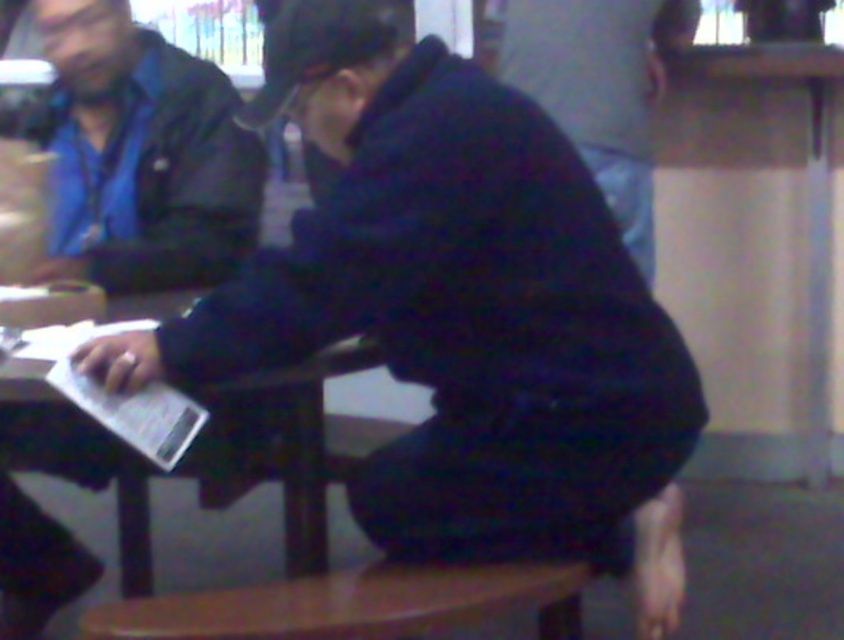
Question: Which of the following is the farthest from the observer?

Choices:
 (A) matte black jacket at upper left
 (B) dark blue fabric at center
 (C) wooden table at center

Answer: (B)

Question: Does wooden stool at lower center have a larger size compared to wooden table at center?

Choices:
 (A) no
 (B) yes

Answer: (A)

Question: Which object is positioned closest to the wooden stool at lower center?

Choices:
 (A) dark blue fabric at center
 (B) matte black jacket at upper left

Answer: (B)

Question: Can you confirm if matte black jacket at upper left is smaller than wooden stool at lower center?

Choices:
 (A) yes
 (B) no

Answer: (B)

Question: Which of the following is the closest to the observer?

Choices:
 (A) matte black jacket at upper left
 (B) wooden table at center

Answer: (B)

Question: Is matte black jacket at upper left positioned at the back of dark blue fabric at center?

Choices:
 (A) yes
 (B) no

Answer: (B)